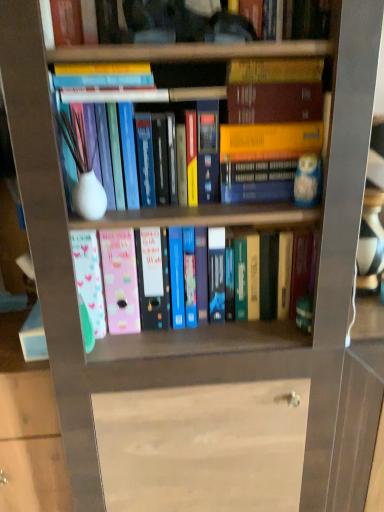
Question: Is there a large distance between matte white vase at center, the 2th book positioned from the bottom, and hardcover book at upper center, marked as the second book in a top-to-bottom arrangement?

Choices:
 (A) yes
 (B) no

Answer: (B)

Question: From a real-world perspective, is matte white vase at center, the 2th book positioned from the bottom, positioned over hardcover book at upper center, arranged as the 3th book when ordered from the bottom, based on gravity?

Choices:
 (A) no
 (B) yes

Answer: (A)

Question: Is matte white vase at center, the third book when ordered from top to bottom, outside hardcover book at upper center, arranged as the 3th book when ordered from the bottom?

Choices:
 (A) no
 (B) yes

Answer: (B)

Question: Considering the relative positions of matte white vase at center, the 2th book positioned from the bottom, and hardcover book at upper center, arranged as the 3th book when ordered from the bottom, in the image provided, is matte white vase at center, the 2th book positioned from the bottom, to the right of hardcover book at upper center, arranged as the 3th book when ordered from the bottom, from the viewer's perspective?

Choices:
 (A) yes
 (B) no

Answer: (A)

Question: Does matte white vase at center, the 2th book positioned from the bottom, contain hardcover book at upper center, arranged as the 3th book when ordered from the bottom?

Choices:
 (A) yes
 (B) no

Answer: (B)

Question: From the image's perspective, would you say matte white vase at center, the third book when ordered from top to bottom, is shown under hardcover book at upper center, arranged as the 3th book when ordered from the bottom?

Choices:
 (A) no
 (B) yes

Answer: (B)

Question: Could you tell me if hardcover book at upper center, arranged as the 3th book when ordered from the bottom, is facing hardcover book at upper center, placed as the first book when sorted from top to bottom?

Choices:
 (A) no
 (B) yes

Answer: (A)

Question: From the image's perspective, is hardcover book at upper center, arranged as the 3th book when ordered from the bottom, located beneath hardcover book at upper center, which is counted as the 4th book, starting from the bottom?

Choices:
 (A) no
 (B) yes

Answer: (B)

Question: Is hardcover book at upper center, marked as the second book in a top-to-bottom arrangement, directly adjacent to hardcover book at upper center, placed as the first book when sorted from top to bottom?

Choices:
 (A) no
 (B) yes

Answer: (A)

Question: Does hardcover book at upper center, marked as the second book in a top-to-bottom arrangement, have a lesser height compared to hardcover book at upper center, which is counted as the 4th book, starting from the bottom?

Choices:
 (A) yes
 (B) no

Answer: (A)

Question: From the image's perspective, is hardcover book at upper center, marked as the second book in a top-to-bottom arrangement, above hardcover book at upper center, which is counted as the 4th book, starting from the bottom?

Choices:
 (A) yes
 (B) no

Answer: (B)

Question: Is hardcover book at upper center, arranged as the 3th book when ordered from the bottom, to the left of hardcover book at upper center, placed as the first book when sorted from top to bottom, from the viewer's perspective?

Choices:
 (A) no
 (B) yes

Answer: (B)

Question: Can you confirm if matte white vase at center, the 2th book positioned from the bottom, is bigger than pastel plastic folders at center, the fourth book in the top-to-bottom sequence?

Choices:
 (A) no
 (B) yes

Answer: (A)